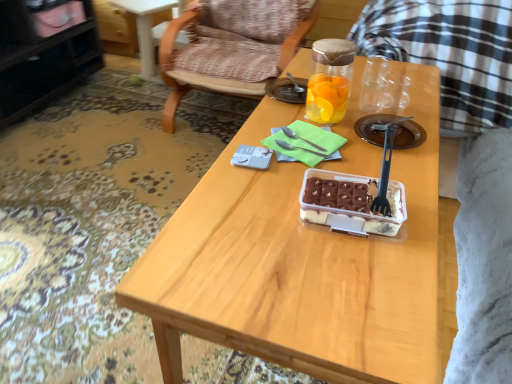
Find the location of a particular element. This screenshot has width=512, height=384. free space that is to the left of transparent glass jar at center is located at coordinates (273, 113).